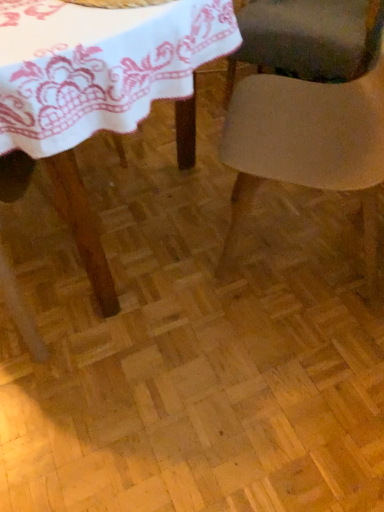
Where is `free space in front of smooth beige chair at center, which appears as the 1th chair when ordered from the bottom`? This screenshot has height=512, width=384. free space in front of smooth beige chair at center, which appears as the 1th chair when ordered from the bottom is located at coordinates (288, 362).